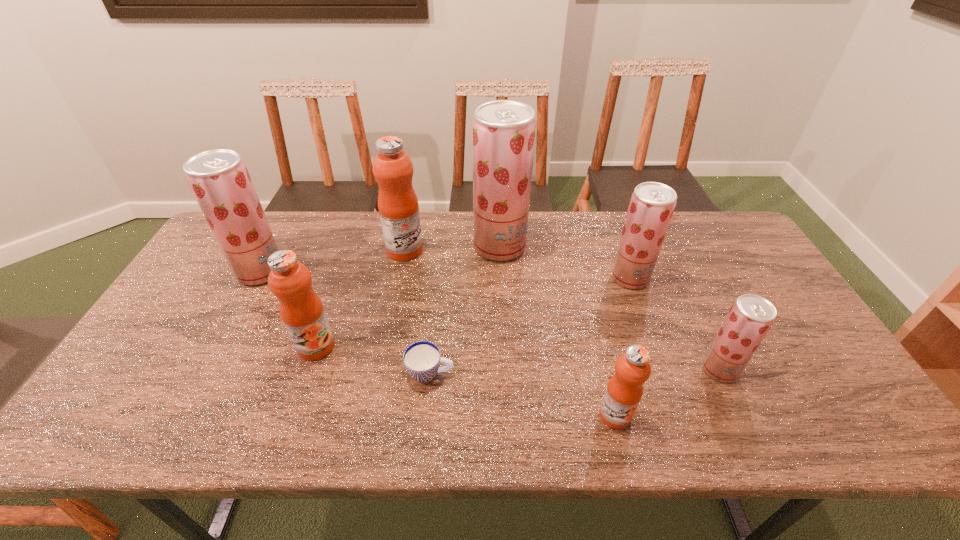
What are the coordinates of `vacant space at the far right corner` in the screenshot? It's located at (700, 211).

Locate an element on the screen. Image resolution: width=960 pixels, height=540 pixels. vacant area at the near right corner of the desktop is located at coordinates (805, 420).

The image size is (960, 540). What are the coordinates of `empty space that is in between the biggest strawberry fruit juice and the smallest orange fruit juice` in the screenshot? It's located at (558, 331).

At what (x,y) coordinates should I click in order to perform the action: click on free space between the shortest object and the second strawberry fruit juice from right to left. Please return your answer as a coordinate pair (x, y). The width and height of the screenshot is (960, 540). Looking at the image, I should click on (530, 325).

The width and height of the screenshot is (960, 540). I want to click on free spot between the biggest strawberry fruit juice and the rightmost strawberry fruit juice, so tap(610, 308).

At what (x,y) coordinates should I click in order to perform the action: click on free point between the blue cup and the second biggest strawberry fruit juice. Please return your answer as a coordinate pair (x, y). Looking at the image, I should click on (346, 322).

Where is `free spot between the nearest object and the third strawberry fruit juice from left to right`? The width and height of the screenshot is (960, 540). free spot between the nearest object and the third strawberry fruit juice from left to right is located at coordinates (622, 346).

The width and height of the screenshot is (960, 540). I want to click on free space between the leftmost strawberry fruit juice and the second object from right to left, so click(445, 274).

Locate an element on the screen. This screenshot has height=540, width=960. free space between the nearest fruit juice and the second object from left to right is located at coordinates (466, 381).

The height and width of the screenshot is (540, 960). I want to click on free area in between the fifth object from right to left and the nearest strawberry fruit juice, so click(575, 371).